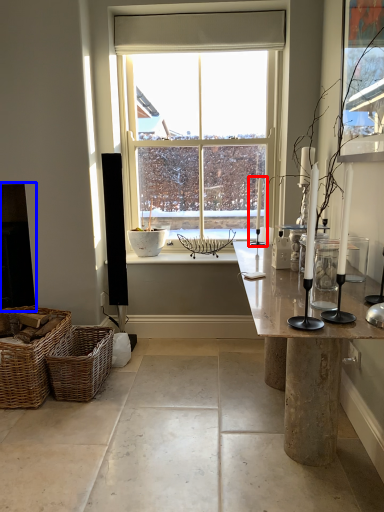
Question: Which object is closer to the camera taking this photo, candle holder (highlighted by a red box) or fireplace (highlighted by a blue box)?

Choices:
 (A) candle holder
 (B) fireplace

Answer: (A)